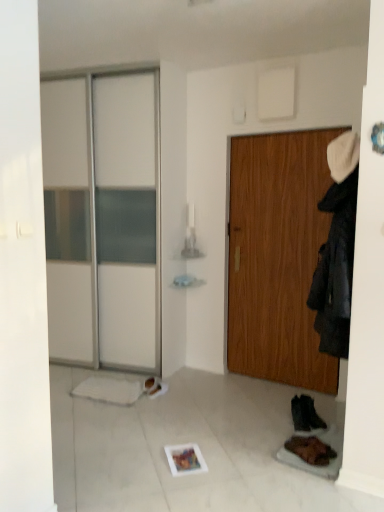
Question: Looking at the image, does wooden door at center seem bigger or smaller compared to black suede boot at lower right, positioned as the first footwear in back-to-front order?

Choices:
 (A) small
 (B) big

Answer: (B)

Question: In the image, is wooden door at center positioned in front of or behind black suede boot at lower right, arranged as the 2th footwear when viewed from the front?

Choices:
 (A) behind
 (B) front

Answer: (A)

Question: Which object is positioned closest to the wooden door at center?

Choices:
 (A) black suede boot at lower right, arranged as the 2th footwear when viewed from the front
 (B) dark gray fabric coat at right
 (C) brown leather boot at lower right, the first footwear viewed from the front

Answer: (A)

Question: Which object is the closest to the black suede boot at lower right, positioned as the first footwear in back-to-front order?

Choices:
 (A) wooden door at center
 (B) dark gray fabric coat at right
 (C) brown leather boot at lower right, the 2th footwear in the back-to-front sequence

Answer: (C)